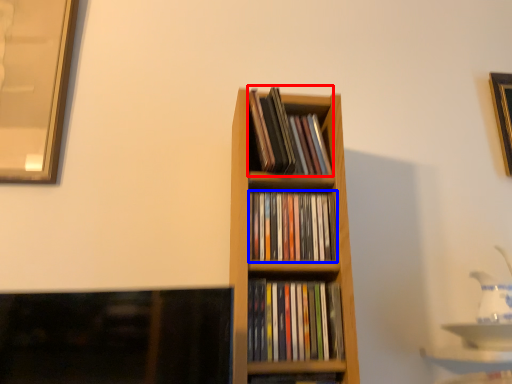
Question: Which object is closer to the camera taking this photo, book (highlighted by a red box) or book (highlighted by a blue box)?

Choices:
 (A) book
 (B) book

Answer: (B)